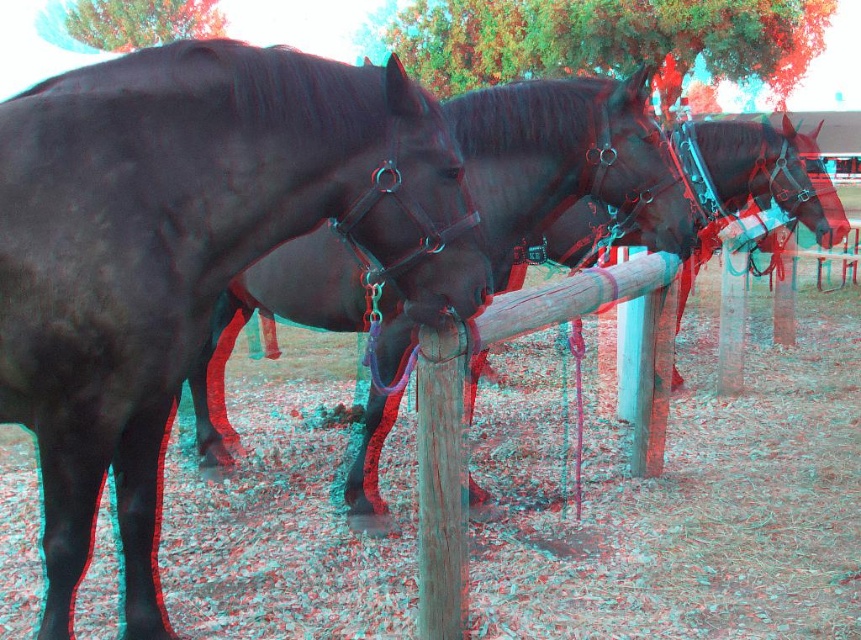
You are a farmer checking the paddock. You notice the shiny black horse at left and the wooden post at center. Which object takes up more space in the image?

The shiny black horse at left takes up more space in the image because it is bigger than the wooden post at center.

You are a horse trainer assessing the horses in the paddock. You need to determine which horse is taller between the shiny black horse at left and the shiny black horse at center. Based on the scene, which one is taller?

The shiny black horse at left is much taller than the shiny black horse at center.